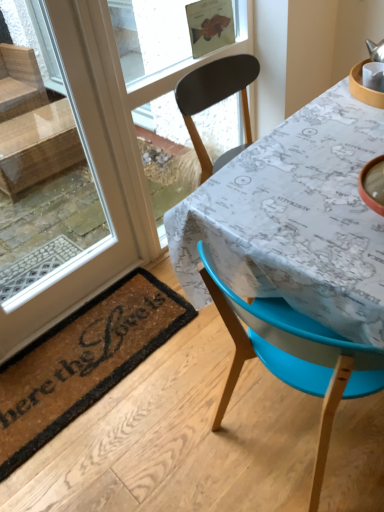
Question: Is the depth of map-patterned fabric at center less than that of blue plastic chair at lower right?

Choices:
 (A) yes
 (B) no

Answer: (B)

Question: Does map-patterned fabric at center have a greater width compared to blue plastic chair at lower right?

Choices:
 (A) no
 (B) yes

Answer: (B)

Question: Is map-patterned fabric at center smaller than blue plastic chair at lower right?

Choices:
 (A) no
 (B) yes

Answer: (A)

Question: From the image's perspective, does map-patterned fabric at center appear higher than blue plastic chair at lower right?

Choices:
 (A) yes
 (B) no

Answer: (A)

Question: Is map-patterned fabric at center not near blue plastic chair at lower right?

Choices:
 (A) yes
 (B) no

Answer: (B)

Question: In terms of width, does transparent glass window screen at upper center look wider or thinner when compared to map-patterned fabric at center?

Choices:
 (A) thin
 (B) wide

Answer: (A)

Question: Is point (148, 117) closer or farther from the camera than point (241, 245)?

Choices:
 (A) closer
 (B) farther

Answer: (B)

Question: Considering their positions, is transparent glass window screen at upper center located in front of or behind map-patterned fabric at center?

Choices:
 (A) front
 (B) behind

Answer: (B)

Question: In the image, is transparent glass window screen at upper center on the left side or the right side of map-patterned fabric at center?

Choices:
 (A) left
 (B) right

Answer: (A)

Question: Is map-patterned fabric at center bigger or smaller than blue plastic chair at lower right?

Choices:
 (A) big
 (B) small

Answer: (A)

Question: Which is correct: map-patterned fabric at center is inside blue plastic chair at lower right, or outside of it?

Choices:
 (A) inside
 (B) outside

Answer: (B)

Question: Does point pyautogui.click(x=332, y=132) appear closer or farther from the camera than point pyautogui.click(x=301, y=321)?

Choices:
 (A) farther
 (B) closer

Answer: (A)

Question: In terms of width, does map-patterned fabric at center look wider or thinner when compared to blue plastic chair at lower right?

Choices:
 (A) wide
 (B) thin

Answer: (A)

Question: Is blue plastic chair at lower right wider or thinner than map-patterned fabric at center?

Choices:
 (A) thin
 (B) wide

Answer: (A)

Question: From a real-world perspective, relative to map-patterned fabric at center, is blue plastic chair at lower right vertically above or below?

Choices:
 (A) above
 (B) below

Answer: (A)